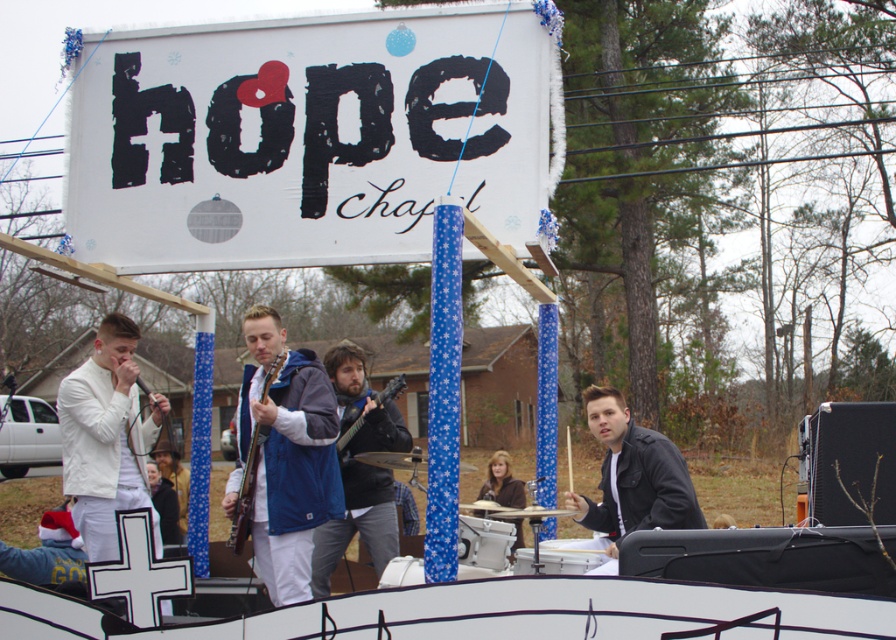
You are a stagehand who needs to place a 1.2 meter wide equipment box between the wooden acoustic guitar at center and the shiny silver cymbal at center. Can the box fit between them?

The wooden acoustic guitar at center is wider than the shiny silver cymbal at center. The combined width of both objects would be greater than the space available, so placing a 1.2 meter wide equipment box between them may not be feasible unless there is sufficient space between them. However, since the description only states the guitar is wider than the cymbal but does not provide exact measurements, it is unclear if the box will fit. Further measurements are needed.

You are a photographer standing in front of the stage. You want to take a photo of both point [373,484] and point [260,435]. Which point is closer to your camera lens?

Point [260,435] is closer to the camera lens because it is less further to the viewer than point [373,484].